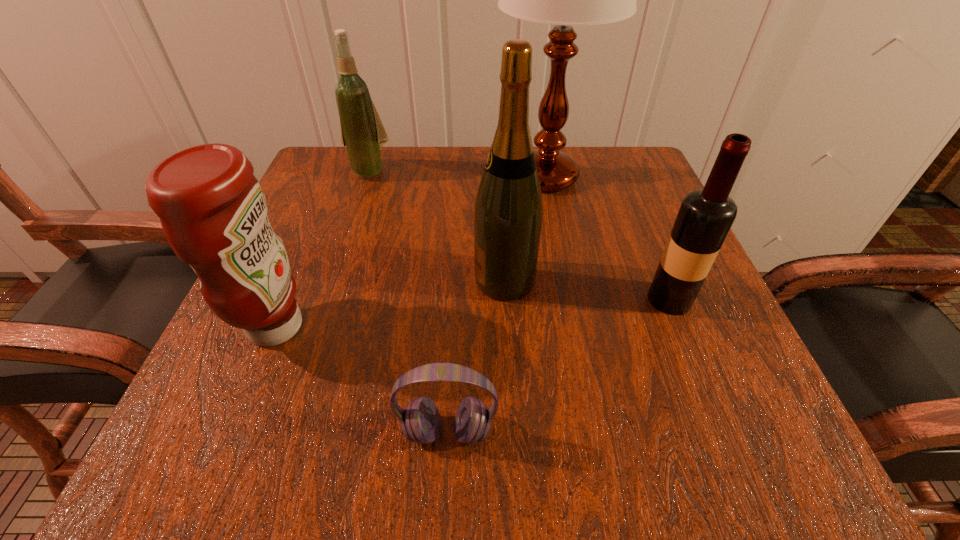
The width and height of the screenshot is (960, 540). In order to click on the tallest object in this screenshot , I will do pyautogui.click(x=565, y=0).

The height and width of the screenshot is (540, 960). What are the coordinates of `the tallest wine bottle` in the screenshot? It's located at (508, 214).

This screenshot has height=540, width=960. Find the location of `the second wine bottle from right to left`. the second wine bottle from right to left is located at coordinates (508, 214).

Image resolution: width=960 pixels, height=540 pixels. I want to click on the leftmost wine bottle, so click(362, 132).

Identify the location of the rightmost object. (705, 217).

I want to click on condiment, so click(x=213, y=212).

The height and width of the screenshot is (540, 960). In order to click on headset in this screenshot , I will do `click(420, 421)`.

You are a GUI agent. You are given a task and a screenshot of the screen. Output one action in this format:
    pyautogui.click(x=<x>, y=<y>)
    Task: Click on the nearest object
    The image size is (960, 540).
    Given the screenshot: What is the action you would take?
    pyautogui.click(x=420, y=421)

You are a GUI agent. You are given a task and a screenshot of the screen. Output one action in this format:
    pyautogui.click(x=<x>, y=<y>)
    Task: Click on the vacant point located 0.160m on the front of the tallest object
    
    Given the screenshot: What is the action you would take?
    pyautogui.click(x=563, y=262)

Find the location of a particular element. Image resolution: width=960 pixels, height=540 pixels. vacant space situated 0.200m on the front-facing side of the second tallest object is located at coordinates (358, 280).